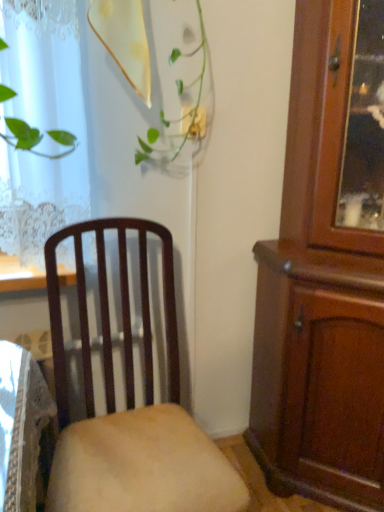
Describe the element at coordinates (326, 270) in the screenshot. I see `mahogany wood cabinet at right` at that location.

Measure the distance between point [336,445] and camera.

Point [336,445] is 4.39 feet from camera.

Locate an element on the screen. This screenshot has width=384, height=512. mahogany wood cabinet at right is located at coordinates [326, 270].

The height and width of the screenshot is (512, 384). Describe the element at coordinates (130, 404) in the screenshot. I see `matte wood chair at center` at that location.

Where is `matte wood chair at center`? matte wood chair at center is located at coordinates click(x=130, y=404).

What are the coordinates of `mahogany wood cabinet at right` in the screenshot? It's located at (326, 270).

Which is more to the left, matte wood chair at center or mahogany wood cabinet at right?

matte wood chair at center is more to the left.

In the image, is matte wood chair at center positioned in front of or behind mahogany wood cabinet at right?

matte wood chair at center is positioned closer to the viewer than mahogany wood cabinet at right.

Which point is more distant from viewer, (96, 246) or (382, 434)?

The point (382, 434) is farther from the camera.

From the picture: From the image's perspective, does matte wood chair at center appear lower than mahogany wood cabinet at right?

Indeed, from the image's perspective, matte wood chair at center is shown beneath mahogany wood cabinet at right.

From a real-world perspective, is matte wood chair at center below mahogany wood cabinet at right?

Indeed, from a real-world perspective, matte wood chair at center is positioned beneath mahogany wood cabinet at right.

Looking at their sizes, would you say matte wood chair at center is wider or thinner than mahogany wood cabinet at right?

Considering their sizes, matte wood chair at center looks broader than mahogany wood cabinet at right.

Which of these two, matte wood chair at center or mahogany wood cabinet at right, stands taller?

mahogany wood cabinet at right is taller.

In the scene shown: Who is bigger, matte wood chair at center or mahogany wood cabinet at right?

mahogany wood cabinet at right is bigger.

Is matte wood chair at center located outside mahogany wood cabinet at right?

matte wood chair at center is positioned outside mahogany wood cabinet at right.

Consider the image. Is matte wood chair at center with mahogany wood cabinet at right?

There is a gap between matte wood chair at center and mahogany wood cabinet at right.

Is matte wood chair at center oriented towards mahogany wood cabinet at right?

No, matte wood chair at center is not aimed at mahogany wood cabinet at right.

Can you tell me how much matte wood chair at center and mahogany wood cabinet at right differ in facing direction?

The angle between the facing direction of matte wood chair at center and the facing direction of mahogany wood cabinet at right is 51 degrees.

How much distance is there between matte wood chair at center and mahogany wood cabinet at right?

matte wood chair at center is 20.13 inches away from mahogany wood cabinet at right.

I want to click on cabinetry above the matte wood chair at center (from a real-world perspective), so click(326, 270).

Which object is positioned more to the left, mahogany wood cabinet at right or matte wood chair at center?

matte wood chair at center.

Looking at this image, between mahogany wood cabinet at right and matte wood chair at center, which one is positioned in front?

matte wood chair at center is closer to the camera.

Is point (331, 489) closer or farther from the camera than point (73, 229)?

Point (331, 489) is positioned farther from the camera compared to point (73, 229).

From the image's perspective, is mahogany wood cabinet at right on top of matte wood chair at center?

Yes, from the image's perspective, mahogany wood cabinet at right is above matte wood chair at center.

From a real-world perspective, between mahogany wood cabinet at right and matte wood chair at center, who is vertically lower?

In real-world perspective, matte wood chair at center is lower.

Looking at this image, in terms of width, does mahogany wood cabinet at right look wider or thinner when compared to matte wood chair at center?

mahogany wood cabinet at right is thinner than matte wood chair at center.

Which of these two, mahogany wood cabinet at right or matte wood chair at center, stands taller?

mahogany wood cabinet at right.

In the scene shown: Between mahogany wood cabinet at right and matte wood chair at center, which one has larger size?

mahogany wood cabinet at right.

Is mahogany wood cabinet at right outside of matte wood chair at center?

mahogany wood cabinet at right lies outside matte wood chair at center's area.

Is mahogany wood cabinet at right far away from matte wood chair at center?

Actually, mahogany wood cabinet at right and matte wood chair at center are a little close together.

Is mahogany wood cabinet at right looking in the opposite direction of matte wood chair at center?

mahogany wood cabinet at right does not have its back to matte wood chair at center.

Measure the distance from mahogany wood cabinet at right to matte wood chair at center.

20.13 inches.

This screenshot has height=512, width=384. Find the location of `chair below the mahogany wood cabinet at right (from the image's perspective)`. chair below the mahogany wood cabinet at right (from the image's perspective) is located at coordinates (130, 404).

Where is `cabinetry above the matte wood chair at center (from the image's perspective)`? cabinetry above the matte wood chair at center (from the image's perspective) is located at coordinates (326, 270).

The image size is (384, 512). I want to click on cabinetry on the right of matte wood chair at center, so click(x=326, y=270).